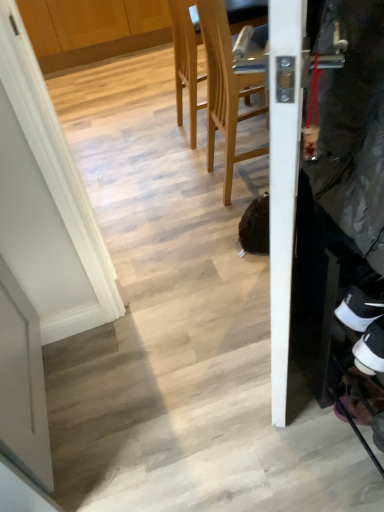
Where is `vacant space positioned to the left of wooden at center, the 2th chair when ordered from back to front`? vacant space positioned to the left of wooden at center, the 2th chair when ordered from back to front is located at coordinates [187, 190].